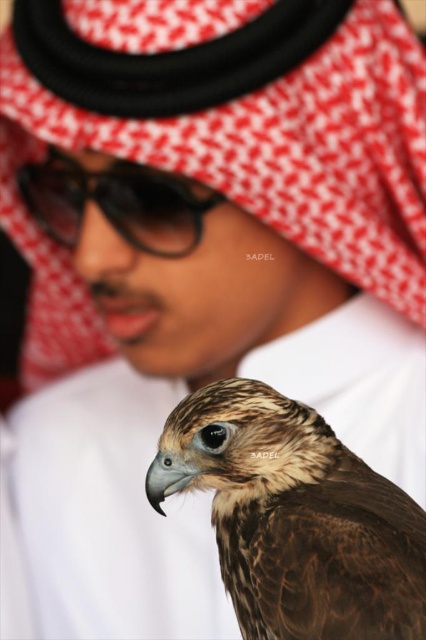
Is brown feathered falcon at lower right thinner than black plastic goggles at upper center?

Indeed, brown feathered falcon at lower right has a lesser width compared to black plastic goggles at upper center.

Is brown feathered falcon at lower right to the left of black plastic goggles at upper center from the viewer's perspective?

Incorrect, brown feathered falcon at lower right is not on the left side of black plastic goggles at upper center.

Is point (411, 541) more distant than point (201, 218)?

No.

Find the location of a particular element. The image size is (426, 640). brown feathered falcon at lower right is located at coordinates (294, 516).